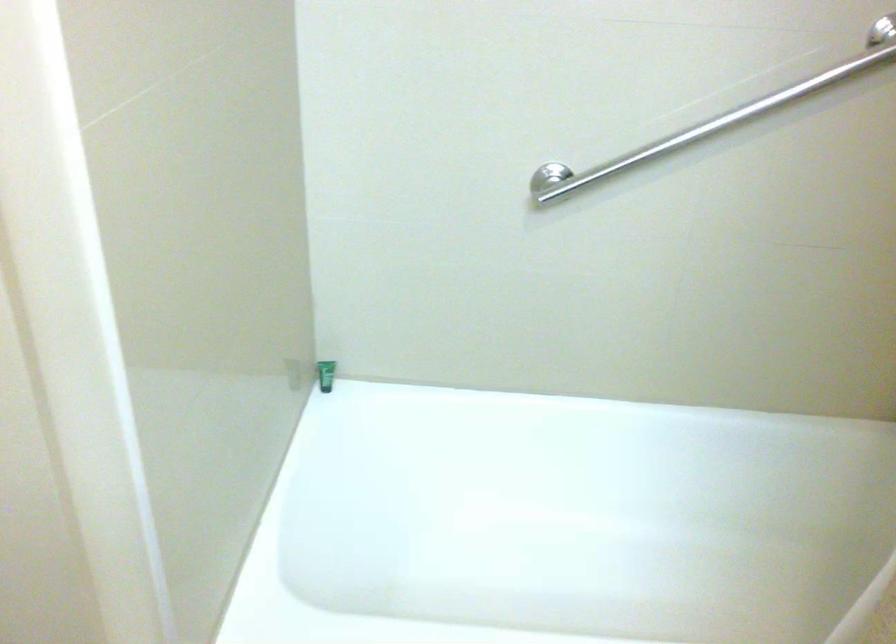
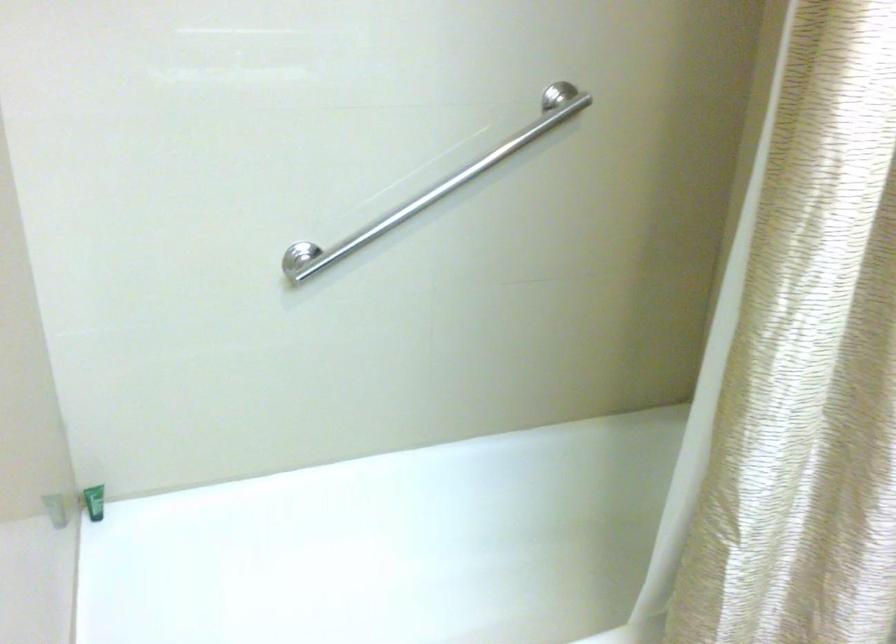
Question: Which direction would the cameraman need to move to produce the second image? Reply with the corresponding letter.

Choices:
 (A) Left
 (B) Right
 (C) Forward
 (D) Backward

Answer: (A)